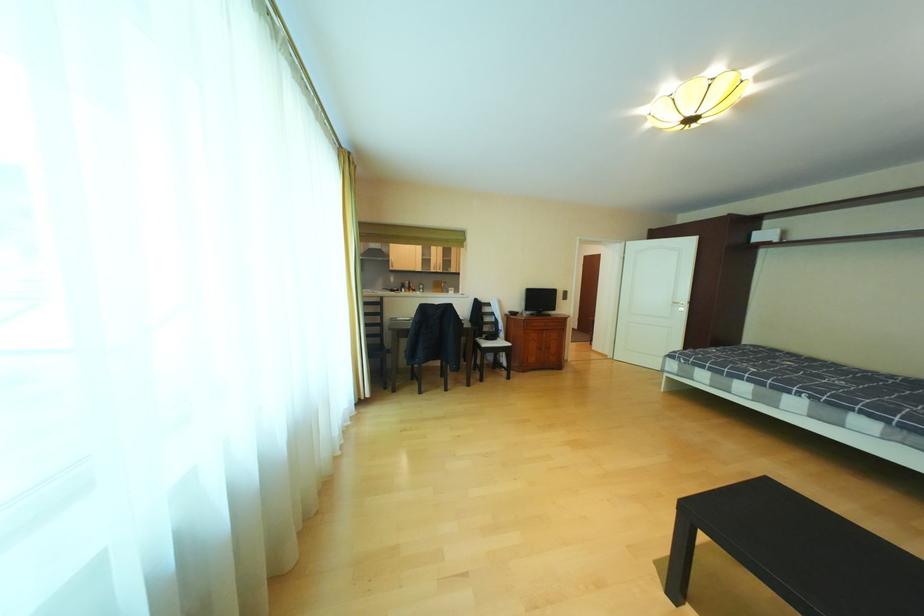
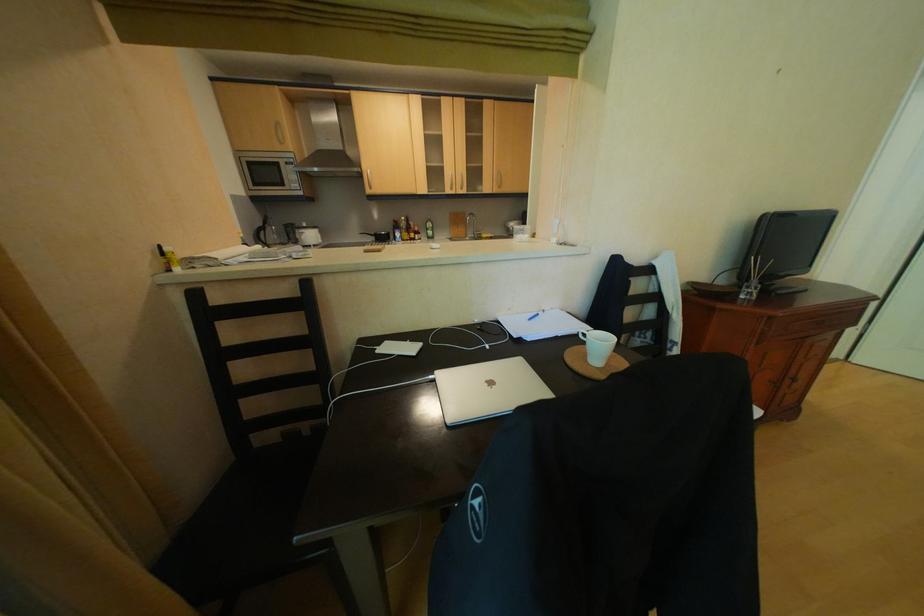
Where in the second image is the point corresponding to pixel 465 270 from the first image?

(499, 188)